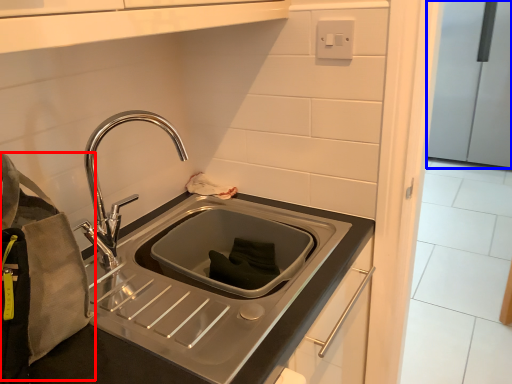
Question: Which object appears farthest to the camera in this image, pouch (highlighted by a red box) or appliance (highlighted by a blue box)?

Choices:
 (A) pouch
 (B) appliance

Answer: (B)